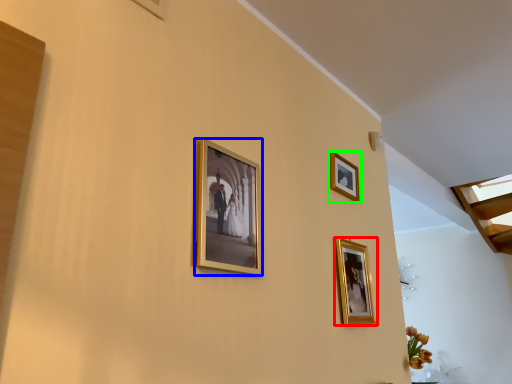
Question: Which is farther away from picture frame (highlighted by a red box)? picture frame (highlighted by a blue box) or picture frame (highlighted by a green box)?

Choices:
 (A) picture frame
 (B) picture frame

Answer: (A)